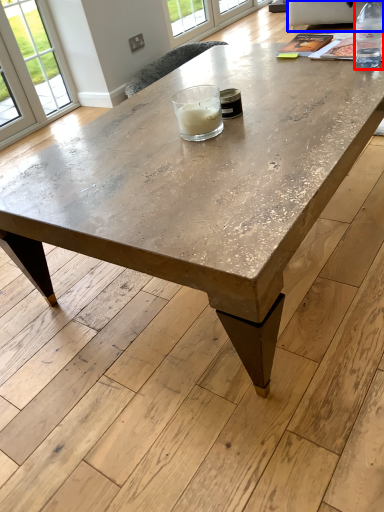
Question: Which point is further to the camera, bottle (highlighted by a red box) or couch (highlighted by a blue box)?

Choices:
 (A) bottle
 (B) couch

Answer: (B)